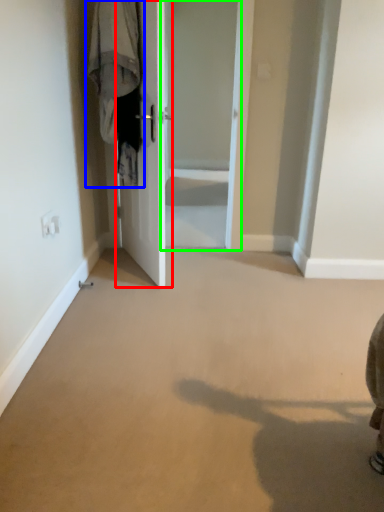
Question: Which object is the closest to the door (highlighted by a red box)? Choose among these: laundry (highlighted by a blue box) or screen door (highlighted by a green box).

Choices:
 (A) laundry
 (B) screen door

Answer: (A)